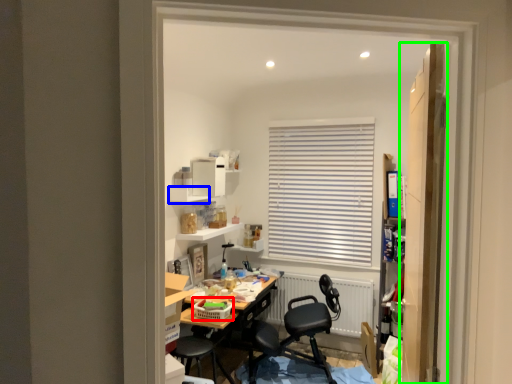
Question: Considering the real-world distances, which object is closest to laundry basket (highlighted by a red box)? shelf (highlighted by a blue box) or door (highlighted by a green box).

Choices:
 (A) shelf
 (B) door

Answer: (A)